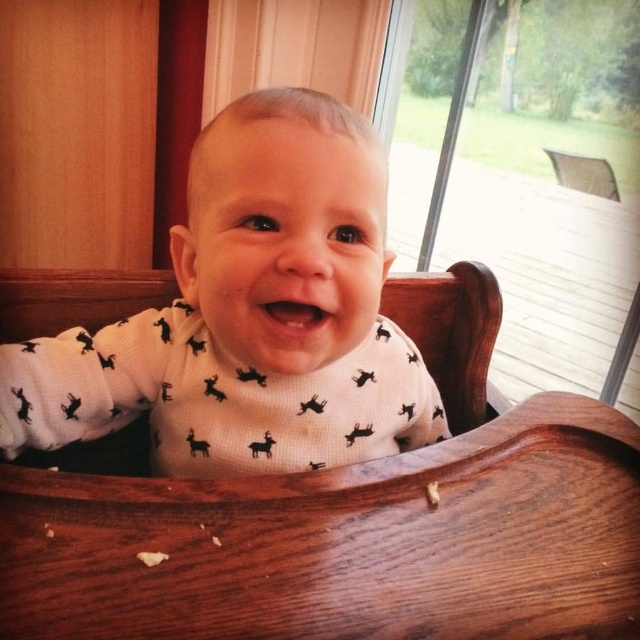
Question: Does white matte onesie at center appear under transparent glass screen door at upper right?

Choices:
 (A) yes
 (B) no

Answer: (A)

Question: Among these objects, which one is nearest to the camera?

Choices:
 (A) transparent glass screen door at upper right
 (B) white matte onesie at center

Answer: (B)

Question: Does white matte onesie at center appear on the left side of transparent glass screen door at upper right?

Choices:
 (A) yes
 (B) no

Answer: (A)

Question: Is white matte onesie at center to the right of transparent glass screen door at upper right from the viewer's perspective?

Choices:
 (A) no
 (B) yes

Answer: (A)

Question: Which object is closer to the camera taking this photo?

Choices:
 (A) white matte onesie at center
 (B) transparent glass screen door at upper right

Answer: (A)

Question: Which object is closer to the camera taking this photo?

Choices:
 (A) white matte onesie at center
 (B) transparent glass screen door at upper right

Answer: (A)